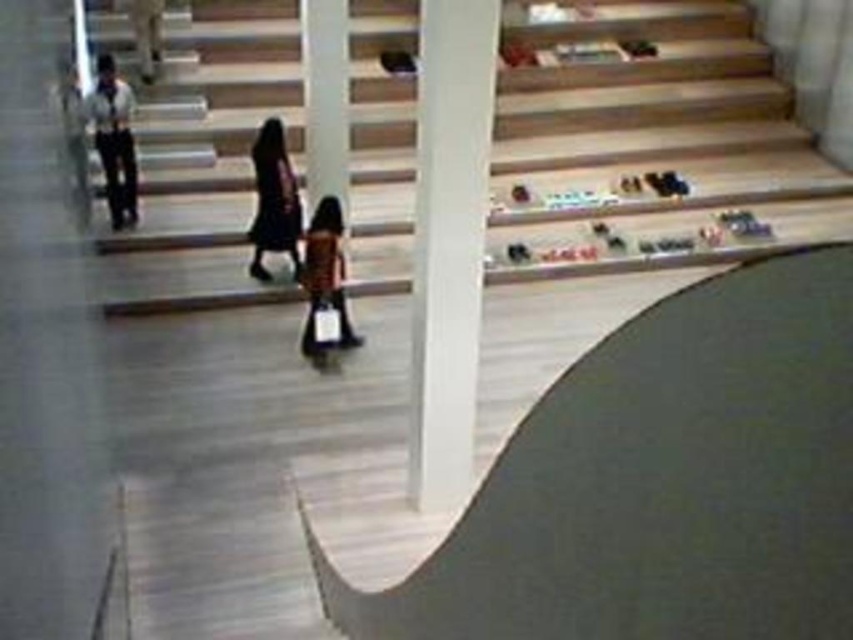
Question: Estimate the real-world distances between objects in this image. Which object is farther from the white glossy pillar at center?

Choices:
 (A) dark purple dress at center
 (B) wooden stairs at center
 (C) matte black jacket at upper left
 (D) white shirt at left

Answer: (C)

Question: Is white shirt at left positioned before orange fabric bag at center?

Choices:
 (A) yes
 (B) no

Answer: (B)

Question: Estimate the real-world distances between objects in this image. Which object is closer to the dark purple dress at center?

Choices:
 (A) matte black jacket at upper left
 (B) white shirt at left
 (C) wooden stairs at center
 (D) orange fabric bag at center

Answer: (D)

Question: Is dark purple dress at center to the right of matte black jacket at upper left from the viewer's perspective?

Choices:
 (A) yes
 (B) no

Answer: (A)

Question: Which object is closer to the camera taking this photo?

Choices:
 (A) matte black jacket at upper left
 (B) white shirt at left
 (C) white glossy pillar at center

Answer: (C)

Question: Can you confirm if dark purple dress at center is bigger than white shirt at left?

Choices:
 (A) no
 (B) yes

Answer: (B)